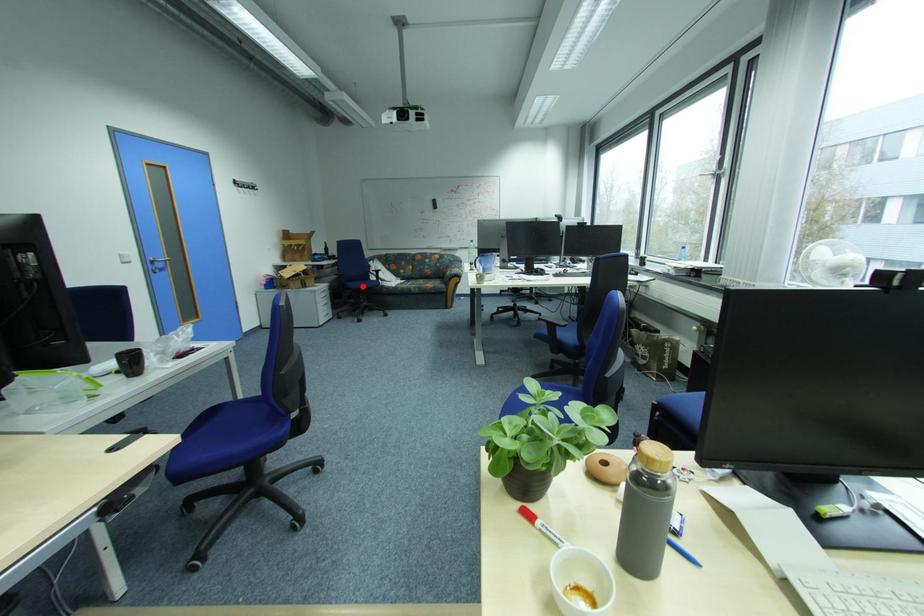
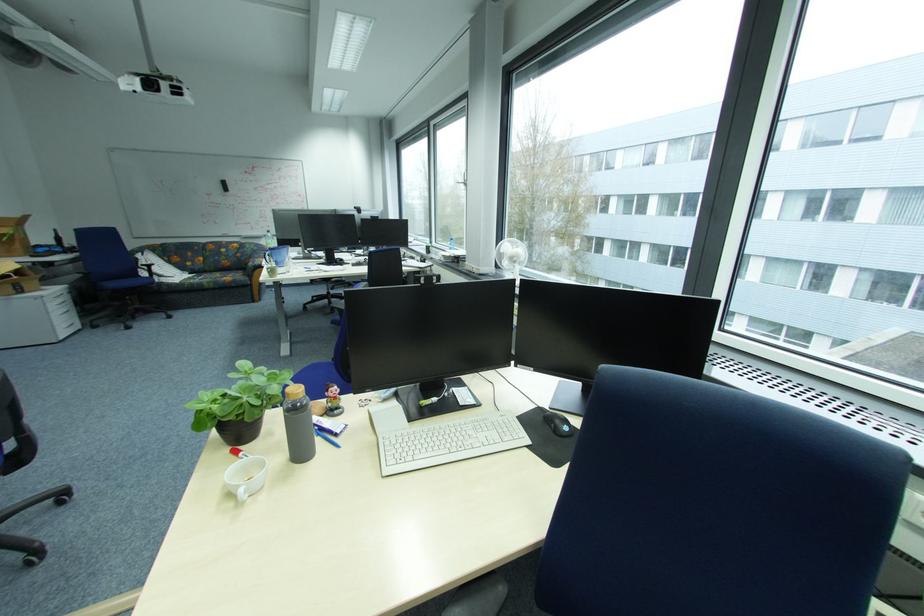
Question: I am providing you with two images of the same scene from different viewpoints. Image1 has a red point marked. In image2, the corresponding 3D location appears at what relative position? Reply with the corresponding letter.

Choices:
 (A) Closer
 (B) Farther

Answer: (B)